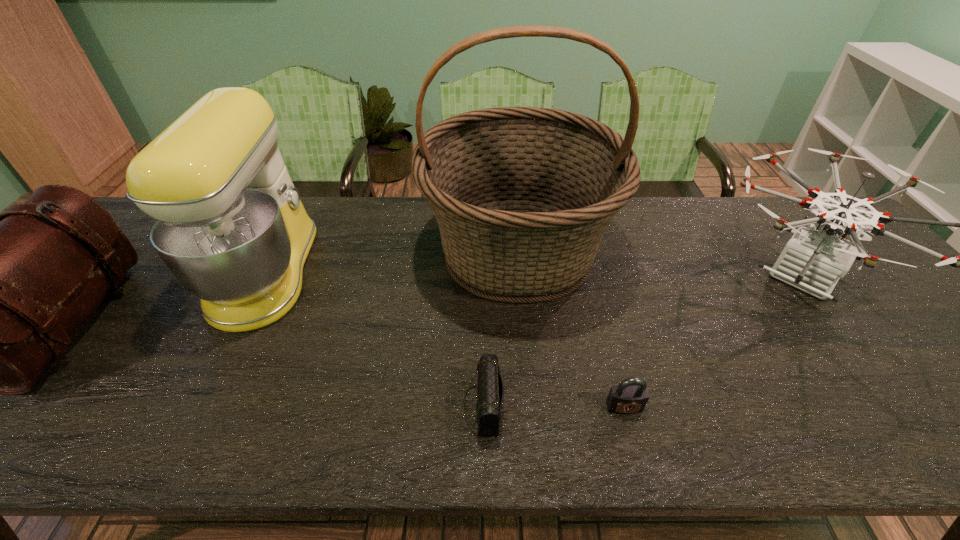
What are the coordinates of `basket` in the screenshot? It's located at (522, 195).

The width and height of the screenshot is (960, 540). In order to click on the second object from left to right in this screenshot , I will do `click(231, 228)`.

Identify the location of the fifth shortest object. This screenshot has height=540, width=960. (231, 228).

Locate an element on the screen. This screenshot has height=540, width=960. the rightmost object is located at coordinates (813, 260).

What are the coordinates of `padlock` in the screenshot? It's located at (631, 395).

Identify the location of clutch bag. The height and width of the screenshot is (540, 960). (490, 394).

Identify the location of free region located on the front of the tallest object. The image size is (960, 540). (535, 448).

Locate an element on the screen. Image resolution: width=960 pixels, height=540 pixels. vacant space located 0.240m on the side of the mixer with the control knob is located at coordinates (402, 273).

Where is `free point located 0.400m on the left of the drone`? free point located 0.400m on the left of the drone is located at coordinates (564, 278).

Identify the location of free space located on the front of the padlock near the keyhole. The height and width of the screenshot is (540, 960). coord(636,454).